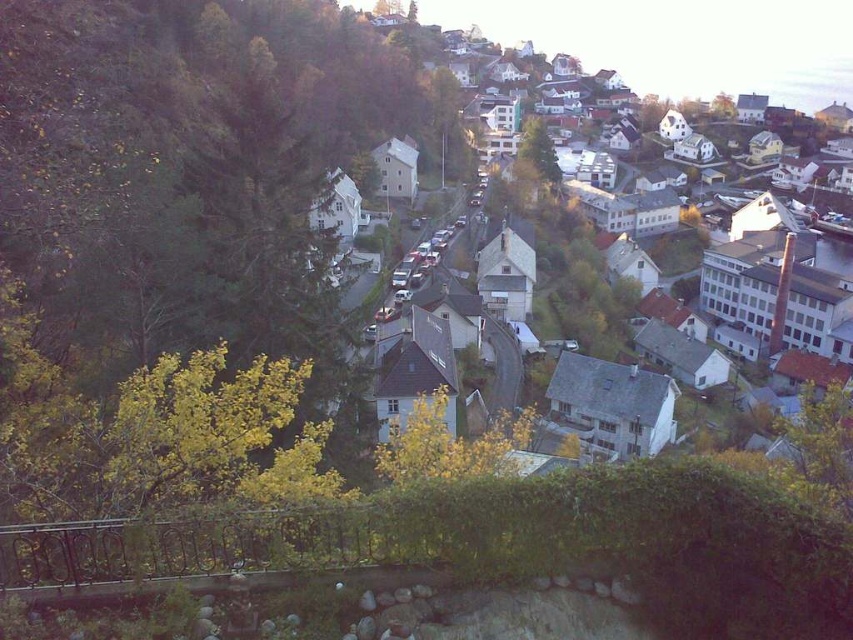
You are planning to install a new streetlight in the town. The white matte houses at upper center and the green leafy tree at center are two landmarks. How far apart are these two landmarks?

The white matte houses at upper center and the green leafy tree at center are 476.04 feet apart.

You are standing at the bottom of the hill looking up at the town. There is a point marked at coordinates (682, 40). What is located at that point?

The point at coordinates (682, 40) indicates white matte houses at upper center.

In the scene shown: You are standing at the base of the hill looking up at the town. Which object is positioned to the right side when comparing the white matte houses at upper center and the green leafy tree at center?

The white matte houses at upper center are positioned to the right of the green leafy tree at center.